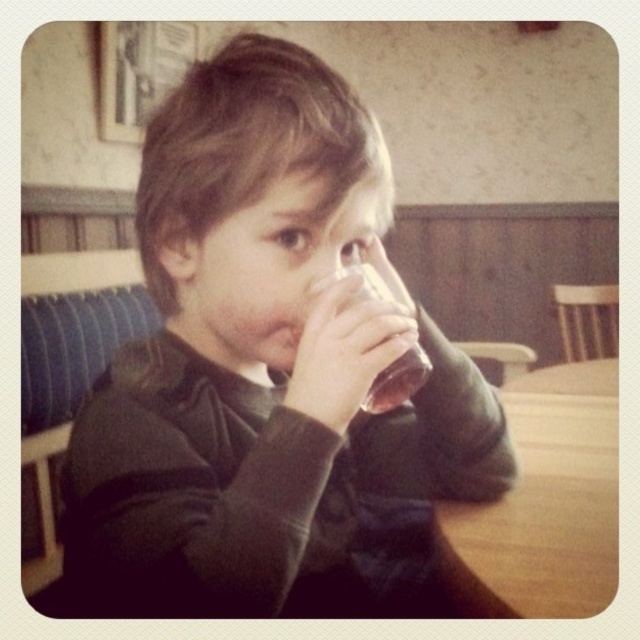
You are a photographer adjusting your camera to focus on two points in the scene. The first point is labeled as point (326, 269), and the second is point (378, 376). Which point should you focus on first if you want to capture the closest object to the camera?

Point (326, 269) is closer to the viewer than point (378, 376), so you should focus on point (326, 269) first to capture the closest object.

You are a parent observing your child drinking from the matte glass at center. You want to ensure the glass is placed safely on the wooden table at lower right. Is the glass too tall to fit on the table?

The matte glass at center is much taller than the wooden table at lower right, so it might not fit properly on the table. Please check the dimensions carefully.